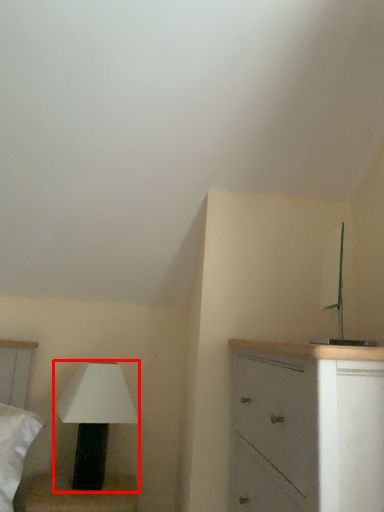
Question: In this image, where is lamp (annotated by the red box) located relative to chest of drawers?

Choices:
 (A) left
 (B) right

Answer: (A)